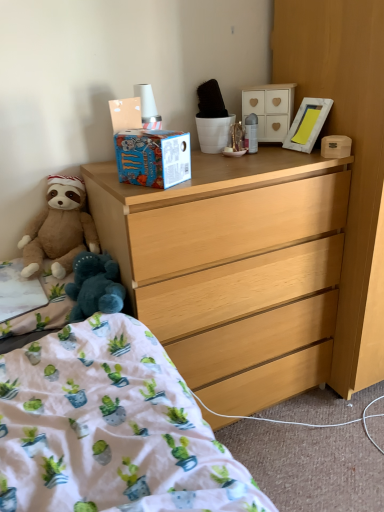
Question: Based on their positions, is light wood dresser at center located to the left or right of brown plush teddy bear at left?

Choices:
 (A) left
 (B) right

Answer: (B)

Question: Choose the correct answer: Is light wood dresser at center inside brown plush teddy bear at left or outside it?

Choices:
 (A) outside
 (B) inside

Answer: (A)

Question: Which is farther from the white matte cabinet at upper center, marked as the first cabinetry in a left-to-right arrangement?

Choices:
 (A) brown plush teddy bear at left
 (B) white wooden picture frame at upper right
 (C) light wood dresser at center
 (D) white cotton bed at lower left
 (E) light wood dresser at center, the first cabinetry in the bottom-to-top sequence

Answer: (D)

Question: Considering the real-world distances, which object is farthest from the white fabric at lower left, marked as the second sheet in a top-to-bottom arrangement?

Choices:
 (A) white matte cabinet at upper center, placed as the first cabinetry when sorted from top to bottom
 (B) light wood dresser at center, acting as the 2th cabinetry starting from the top
 (C) white cotton bed at lower left
 (D) cotton-blend blanket at lower left, acting as the 1th sheet starting from the top
 (E) brown plush teddy bear at left

Answer: (B)